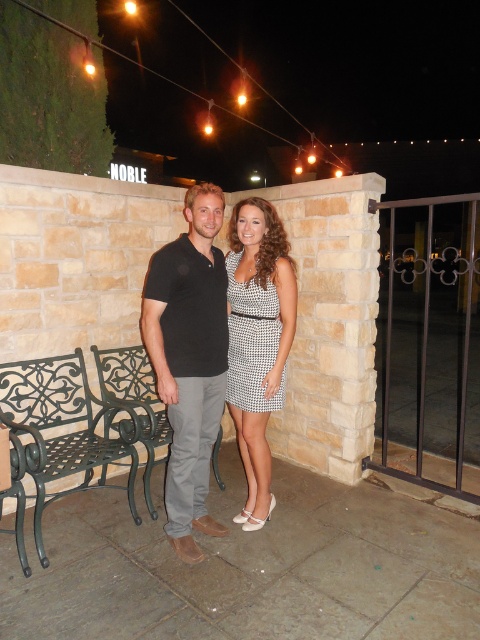
Can you confirm if black cotton polo shirt at center is positioned to the left of green cast iron bench at left?

In fact, black cotton polo shirt at center is to the right of green cast iron bench at left.

Which of these two, black cotton polo shirt at center or green cast iron bench at left, stands shorter?

With less height is green cast iron bench at left.

Which is behind, point (191, 401) or point (149, 365)?

Positioned behind is point (149, 365).

This screenshot has height=640, width=480. I want to click on black cotton polo shirt at center, so click(x=190, y=358).

Does point (284, 317) come closer to viewer compared to point (156, 403)?

That is True.

Measure the distance between point (241, 262) and camera.

Point (241, 262) and camera are 9.27 feet apart.

In order to click on white dotted dress at center in this screenshot , I will do `click(257, 340)`.

What do you see at coordinates (252, 340) in the screenshot?
I see `black dotted dress at center` at bounding box center [252, 340].

Who is more forward, (260, 323) or (165, 408)?

Point (260, 323)

Image resolution: width=480 pixels, height=640 pixels. Find the location of `black dotted dress at center`. black dotted dress at center is located at coordinates (252, 340).